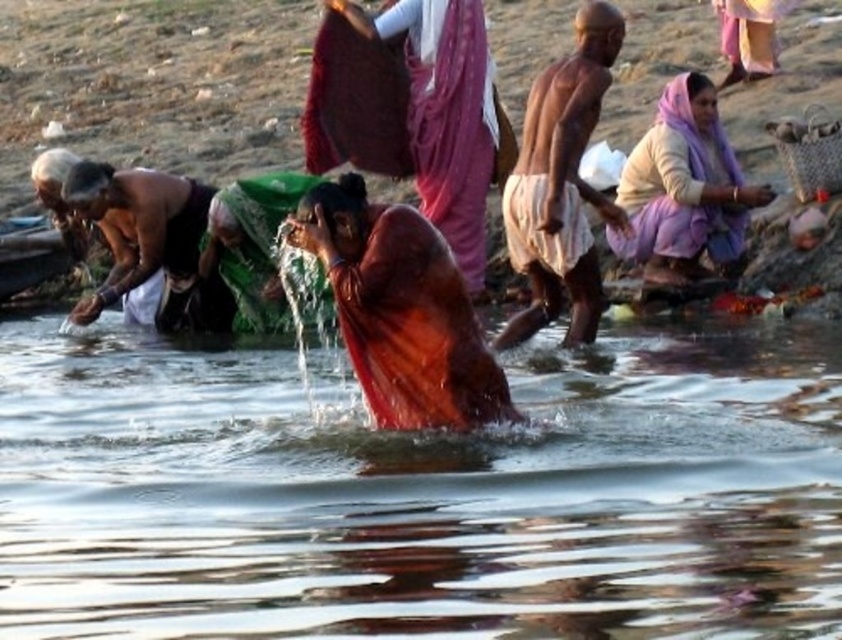
How distant is brown skin man at center from purple fabric headscarf at upper right?

brown skin man at center is 12.50 feet away from purple fabric headscarf at upper right.

Who is positioned more to the right, brown skin man at center or purple fabric headscarf at upper right?

purple fabric headscarf at upper right

What do you see at coordinates (561, 182) in the screenshot? Image resolution: width=842 pixels, height=640 pixels. I see `brown skin man at center` at bounding box center [561, 182].

In order to click on brown skin man at center in this screenshot , I will do `click(561, 182)`.

Can you confirm if transparent water at center is smaller than brown skin man at center?

No, transparent water at center is not smaller than brown skin man at center.

The image size is (842, 640). What do you see at coordinates (421, 493) in the screenshot? I see `transparent water at center` at bounding box center [421, 493].

What do you see at coordinates (421, 493) in the screenshot? I see `transparent water at center` at bounding box center [421, 493].

The image size is (842, 640). What are the coordinates of `transparent water at center` in the screenshot? It's located at tap(421, 493).

In the scene shown: Does matte orange robe at center have a greater height compared to dark skin man at left?

Indeed, matte orange robe at center has a greater height compared to dark skin man at left.

Who is more distant from viewer, (435, 32) or (180, 275)?

The point (180, 275) is more distant.

Which is behind, point (429, 76) or point (157, 317)?

Positioned behind is point (157, 317).

Image resolution: width=842 pixels, height=640 pixels. Identify the location of matte orange robe at center. (449, 118).